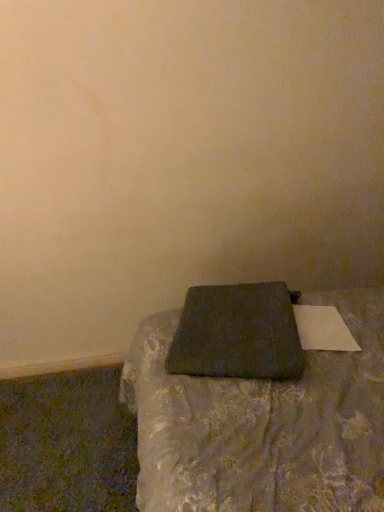
I want to click on dark textured pillow at lower center, so click(x=237, y=333).

Describe the element at coordinates (237, 333) in the screenshot. The image size is (384, 512). I see `dark textured pillow at lower center` at that location.

In order to click on dark textured pillow at lower center in this screenshot , I will do `click(237, 333)`.